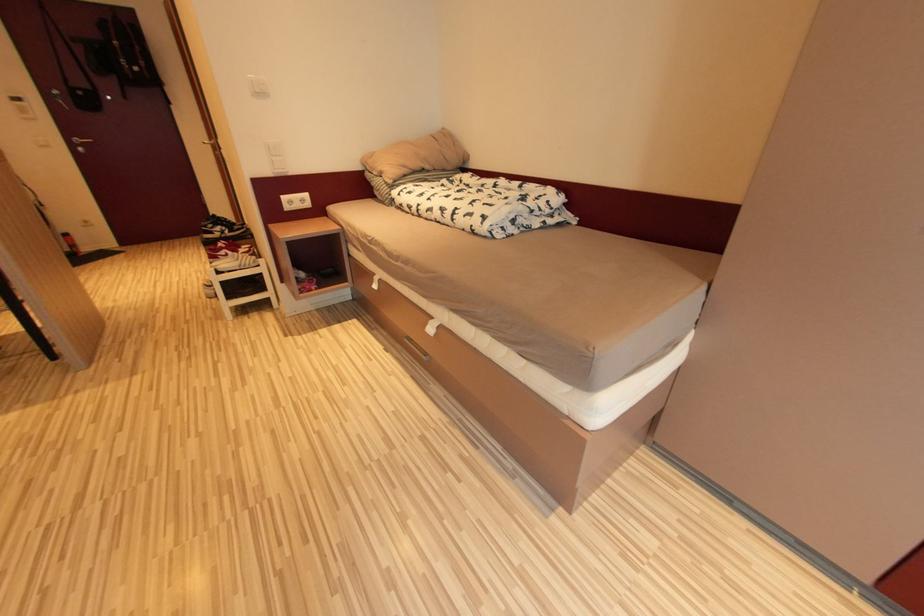
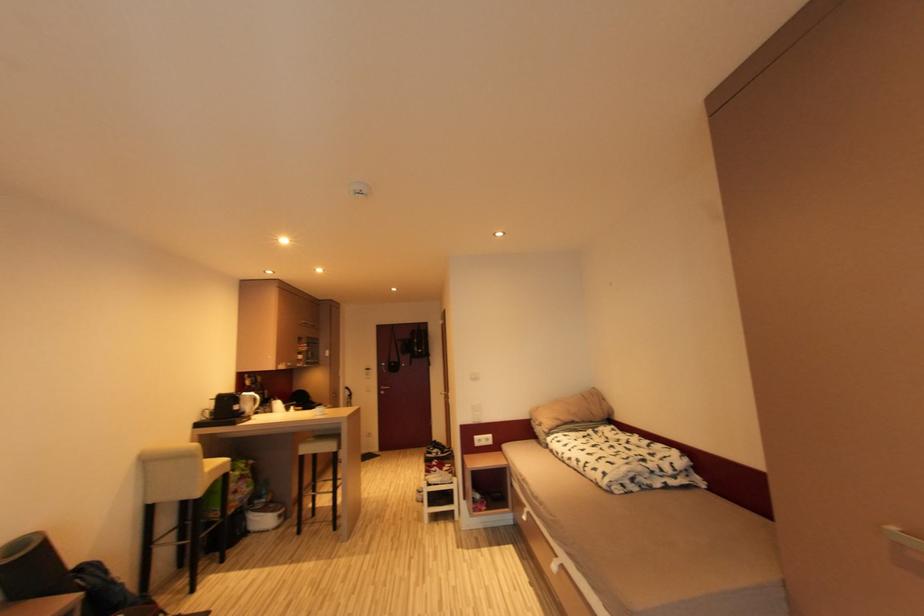
Based on the continuous images, in which direction is the camera rotating?

The camera rotated toward left-up.